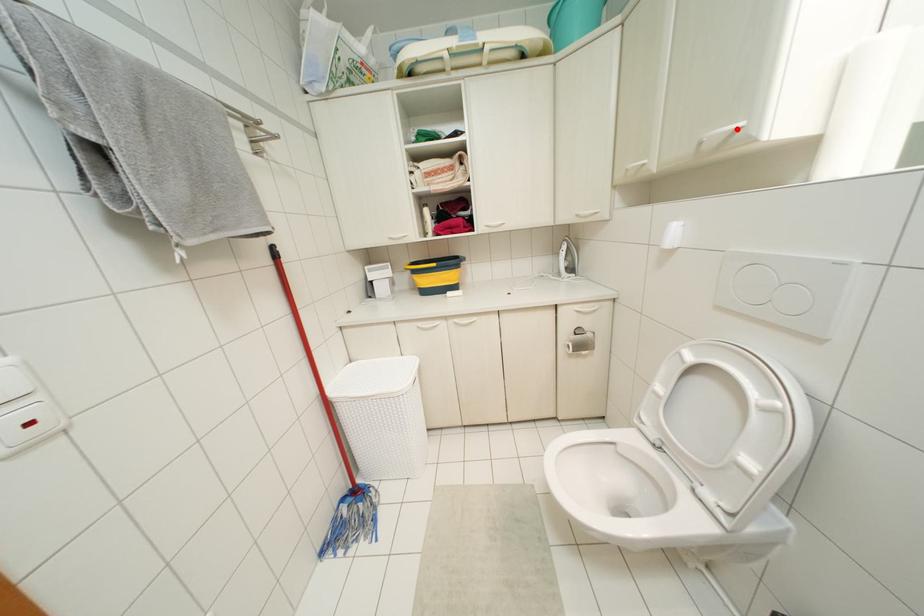
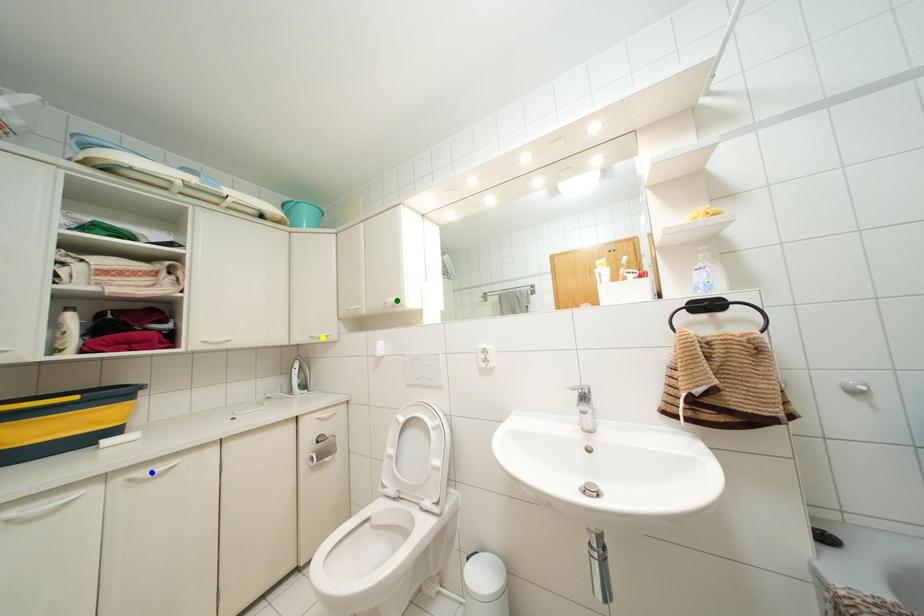
Question: I am providing you with two images of the same scene from different viewpoints. A red point is marked on the first image. You are given multiple points on the second image. Can you choose the point in image 2 that corresponds to the point in image 1?

Choices:
 (A) blue point
 (B) yellow point
 (C) green point

Answer: (C)